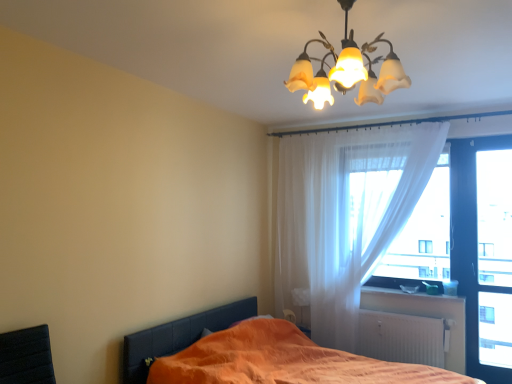
Question: Does translucent white curtain at upper right contain white plastic window sill at lower right?

Choices:
 (A) yes
 (B) no

Answer: (B)

Question: Is translucent white curtain at upper right looking in the opposite direction of white plastic window sill at lower right?

Choices:
 (A) no
 (B) yes

Answer: (B)

Question: From a real-world perspective, is translucent white curtain at upper right positioned under white plastic window sill at lower right based on gravity?

Choices:
 (A) yes
 (B) no

Answer: (B)

Question: Could you tell me if translucent white curtain at upper right is facing white plastic window sill at lower right?

Choices:
 (A) yes
 (B) no

Answer: (A)

Question: From the image's perspective, is translucent white curtain at upper right under white plastic window sill at lower right?

Choices:
 (A) no
 (B) yes

Answer: (A)

Question: Does point (459, 296) appear closer or farther from the camera than point (379, 142)?

Choices:
 (A) farther
 (B) closer

Answer: (B)

Question: Considering the positions of white plastic window sill at lower right and translucent white curtain at upper right in the image, is white plastic window sill at lower right wider or thinner than translucent white curtain at upper right?

Choices:
 (A) thin
 (B) wide

Answer: (A)

Question: In terms of size, does white plastic window sill at lower right appear bigger or smaller than translucent white curtain at upper right?

Choices:
 (A) small
 (B) big

Answer: (A)

Question: Relative to translucent white curtain at upper right, is white plastic window sill at lower right in front or behind?

Choices:
 (A) front
 (B) behind

Answer: (B)

Question: Is point (507, 266) positioned closer to the camera than point (434, 243)?

Choices:
 (A) closer
 (B) farther

Answer: (A)

Question: Is transparent glass door at right, the 1th window screen positioned from the right, inside the boundaries of translucent fabric at right, arranged as the second window screen when viewed from the right, or outside?

Choices:
 (A) outside
 (B) inside

Answer: (A)

Question: Considering the positions of transparent glass door at right, marked as the 2th window screen in a left-to-right arrangement, and translucent fabric at right, placed as the first window screen when sorted from left to right, in the image, is transparent glass door at right, marked as the 2th window screen in a left-to-right arrangement, taller or shorter than translucent fabric at right, placed as the first window screen when sorted from left to right,?

Choices:
 (A) short
 (B) tall

Answer: (B)

Question: In terms of width, does transparent glass door at right, marked as the 2th window screen in a left-to-right arrangement, look wider or thinner when compared to translucent fabric at right, placed as the first window screen when sorted from left to right?

Choices:
 (A) wide
 (B) thin

Answer: (A)

Question: Looking at their shapes, would you say translucent glass chandelier at upper center is wider or thinner than orange fabric bed at lower left?

Choices:
 (A) thin
 (B) wide

Answer: (A)

Question: Is translucent glass chandelier at upper center bigger or smaller than orange fabric bed at lower left?

Choices:
 (A) big
 (B) small

Answer: (B)